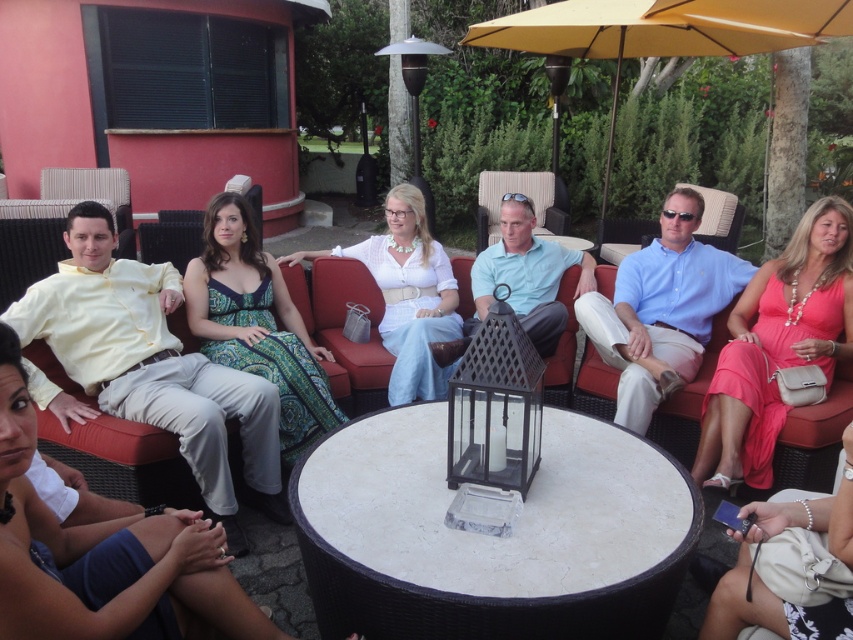
Question: Estimate the real-world distances between objects in this image. Which object is closer to the beige floral dress at lower right?

Choices:
 (A) matte white dress at center
 (B) white cotton dress at center
 (C) pink satin dress at right

Answer: (C)

Question: Is pink satin dress at right behind yellow fabric umbrella at upper center?

Choices:
 (A) yes
 (B) no

Answer: (B)

Question: Which object is positioned closest to the yellow fabric umbrella at upper center?

Choices:
 (A) pink satin dress at right
 (B) white marble table at center
 (C) white cotton dress at center

Answer: (A)

Question: Is yellow cotton shirt at left bigger than pink satin dress at right?

Choices:
 (A) no
 (B) yes

Answer: (B)

Question: Can you confirm if white marble table at center is positioned to the right of matte white dress at center?

Choices:
 (A) yes
 (B) no

Answer: (A)

Question: Estimate the real-world distances between objects in this image. Which object is farther from the light blue shirt at center?

Choices:
 (A) pink satin dress at right
 (B) white marble table at center

Answer: (B)